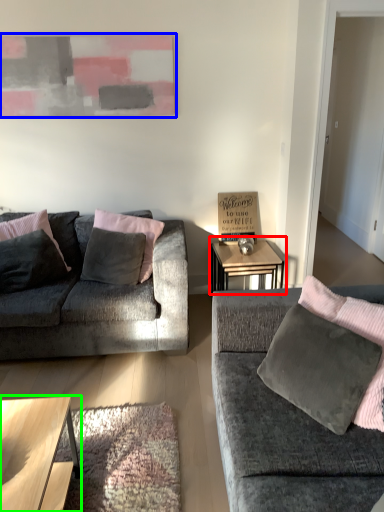
Question: Estimate the real-world distances between objects in this image. Which object is closer to table (highlighted by a red box), picture frame (highlighted by a blue box) or coffee table (highlighted by a green box)?

Choices:
 (A) picture frame
 (B) coffee table

Answer: (A)